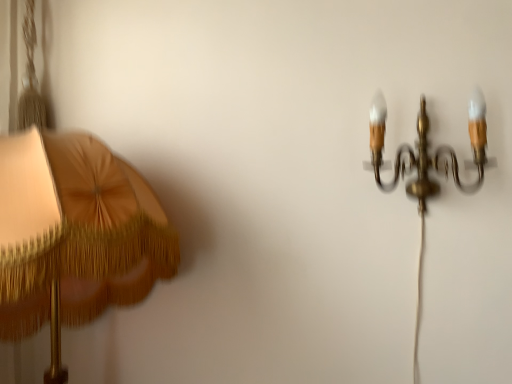
Question: Considering the relative positions of matte gold lampshade at left, the 2th lamp viewed from the right, and gold brass chandelier at upper right, the 2th lamp from the left, in the image provided, is matte gold lampshade at left, the 2th lamp viewed from the right, to the left or to the right of gold brass chandelier at upper right, the 2th lamp from the left,?

Choices:
 (A) right
 (B) left

Answer: (B)

Question: From their relative heights in the image, would you say matte gold lampshade at left, the 2th lamp viewed from the right, is taller or shorter than gold brass chandelier at upper right, the 2th lamp from the left?

Choices:
 (A) tall
 (B) short

Answer: (A)

Question: Considering the positions of point (166, 226) and point (380, 122), is point (166, 226) closer or farther from the camera than point (380, 122)?

Choices:
 (A) farther
 (B) closer

Answer: (A)

Question: Is gold brass chandelier at upper right, the first lamp viewed from the right, inside the boundaries of matte gold lampshade at left, the 2th lamp viewed from the right, or outside?

Choices:
 (A) outside
 (B) inside

Answer: (A)

Question: From a real-world perspective, is gold brass chandelier at upper right, the first lamp viewed from the right, above or below matte gold lampshade at left, which appears as the 1th lamp when viewed from the left?

Choices:
 (A) above
 (B) below

Answer: (A)

Question: Is gold brass chandelier at upper right, the first lamp viewed from the right, to the left or to the right of matte gold lampshade at left, the 2th lamp viewed from the right, in the image?

Choices:
 (A) left
 (B) right

Answer: (B)

Question: Considering the positions of gold brass chandelier at upper right, the 2th lamp from the left, and matte gold lampshade at left, which appears as the 1th lamp when viewed from the left, in the image, is gold brass chandelier at upper right, the 2th lamp from the left, wider or thinner than matte gold lampshade at left, which appears as the 1th lamp when viewed from the left,?

Choices:
 (A) wide
 (B) thin

Answer: (B)